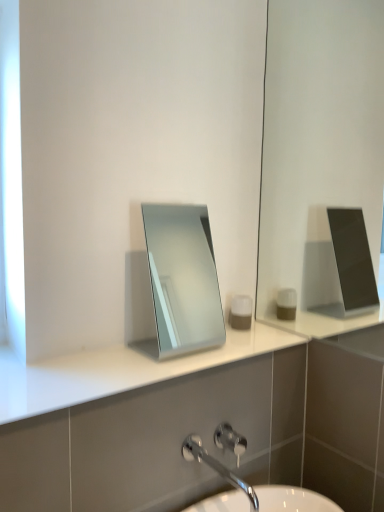
Find the location of a particular element. free space above white glossy counter top at center (from a real-world perspective) is located at coordinates (142, 356).